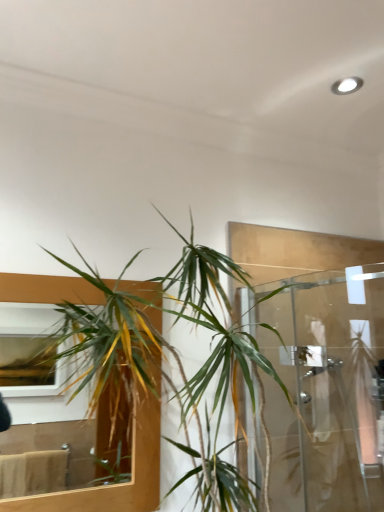
What do you see at coordinates (214, 326) in the screenshot? I see `green leafy plant at center` at bounding box center [214, 326].

The width and height of the screenshot is (384, 512). I want to click on green leafy plant at left, so click(x=111, y=362).

From the image's perspective, between clear glass shower door at right and green leafy plant at center, which one is located above?

green leafy plant at center, from the image's perspective.

Does clear glass shower door at right come in front of green leafy plant at center?

No, clear glass shower door at right is behind green leafy plant at center.

Locate an element on the screen. The height and width of the screenshot is (512, 384). glass door below the green leafy plant at center (from the image's perspective) is located at coordinates (323, 386).

Is clear glass shower door at right shorter than green leafy plant at center?

Yes, clear glass shower door at right is shorter than green leafy plant at center.

What's the angular difference between green leafy plant at left and green leafy plant at center's facing directions?

1.17 degrees separate the facing orientations of green leafy plant at left and green leafy plant at center.

Is green leafy plant at left taller or shorter than green leafy plant at center?

In the image, green leafy plant at left appears to be shorter than green leafy plant at center.

Can you confirm if green leafy plant at left is positioned to the right of green leafy plant at center?

In fact, green leafy plant at left is to the left of green leafy plant at center.

Would you say green leafy plant at left is inside or outside green leafy plant at center?

green leafy plant at left exists outside the volume of green leafy plant at center.

Considering the relative sizes of green leafy plant at left and clear glass shower door at right in the image provided, is green leafy plant at left wider than clear glass shower door at right?

No.

Can you confirm if green leafy plant at left is bigger than clear glass shower door at right?

No, green leafy plant at left is not bigger than clear glass shower door at right.

This screenshot has width=384, height=512. What are the coordinates of `glass door located below the green leafy plant at left (from the image's perspective)` in the screenshot? It's located at (323, 386).

Between green leafy plant at left and clear glass shower door at right, which one is positioned behind?

green leafy plant at left is further away from the camera.

Is the position of green leafy plant at center less distant than that of clear glass shower door at right?

That is True.

Considering the sizes of green leafy plant at center and clear glass shower door at right in the image, is green leafy plant at center bigger or smaller than clear glass shower door at right?

green leafy plant at center is bigger than clear glass shower door at right.

Who is taller, green leafy plant at center or clear glass shower door at right?

green leafy plant at center.

How many degrees apart are the facing directions of green leafy plant at center and clear glass shower door at right?

green leafy plant at center and clear glass shower door at right are facing 88.2 degrees away from each other.

Is clear glass shower door at right positioned far away from green leafy plant at left?

Actually, clear glass shower door at right and green leafy plant at left are a little close together.

Is clear glass shower door at right facing away from green leafy plant at left?

No, clear glass shower door at right is not facing away from green leafy plant at left.

Does point (239, 304) appear closer or farther from the camera than point (102, 351)?

Clearly, point (239, 304) is more distant from the camera than point (102, 351).

From the image's perspective, is green leafy plant at center located beneath green leafy plant at left?

No, from the image's perspective, green leafy plant at center is not beneath green leafy plant at left.

Which object is wider, green leafy plant at center or green leafy plant at left?

With larger width is green leafy plant at center.

How different are the orientations of green leafy plant at center and green leafy plant at left in degrees?

They differ by 1.17 degrees in their facing directions.

Based on the photo, is there a large distance between green leafy plant at center and green leafy plant at left?

No, green leafy plant at center is not far from green leafy plant at left.

Locate an element on the screen. The width and height of the screenshot is (384, 512). houseplant that appears on the left of clear glass shower door at right is located at coordinates (214, 326).

The height and width of the screenshot is (512, 384). Identify the location of houseplant above the green leafy plant at left (from the image's perspective). (214, 326).

From the image, which object appears to be farther from clear glass shower door at right, green leafy plant at left or green leafy plant at center?

The object further to clear glass shower door at right is green leafy plant at left.

Which object lies nearer to the anchor point green leafy plant at center, clear glass shower door at right or green leafy plant at left?

green leafy plant at left.

Which object lies further to the anchor point green leafy plant at left, green leafy plant at center or clear glass shower door at right?

clear glass shower door at right is further to green leafy plant at left.

Which object lies nearer to the anchor point clear glass shower door at right, green leafy plant at center or green leafy plant at left?

green leafy plant at center is closer to clear glass shower door at right.

Considering their positions, is green leafy plant at left positioned closer to green leafy plant at center than clear glass shower door at right?

Among the two, green leafy plant at left is located nearer to green leafy plant at center.

From the image, which object appears to be farther from green leafy plant at left, clear glass shower door at right or green leafy plant at center?

clear glass shower door at right.

Locate an element on the screen. This screenshot has height=512, width=384. houseplant between green leafy plant at left and clear glass shower door at right is located at coordinates (214, 326).